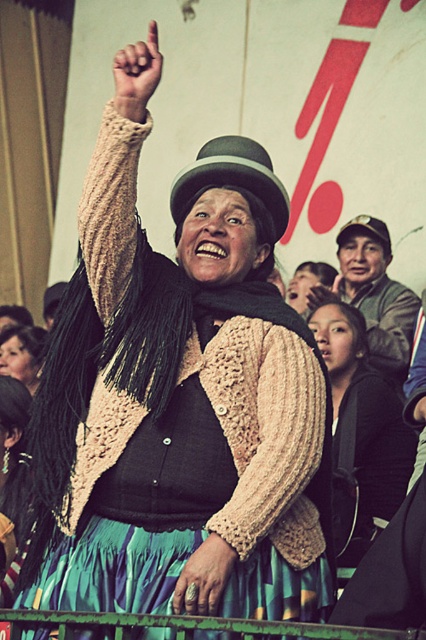
Question: Can you confirm if green painted metal rail at lower center is smaller than light beige knitted finger at upper left?

Choices:
 (A) yes
 (B) no

Answer: (B)

Question: Considering the real-world distances, which object is farthest from the crochet beige sweater at center?

Choices:
 (A) matte black hair at upper left
 (B) smooth skin hand at upper center
 (C) silver metallic ring at center

Answer: (A)

Question: Which object is the closest to the matte black hand at upper center?

Choices:
 (A) matte black jacket at center
 (B) green felt hat at upper right
 (C) matte gray cap at upper right

Answer: (C)

Question: Does green felt bowler hat at center have a greater width compared to silver metallic ring at center?

Choices:
 (A) no
 (B) yes

Answer: (B)

Question: Which point is farther to the camera?

Choices:
 (A) green painted metal rail at lower center
 (B) matte black scarf at center
 (C) crochet beige sweater at center

Answer: (B)

Question: Is crochet beige sweater at center above green felt bowler hat at center?

Choices:
 (A) yes
 (B) no

Answer: (B)